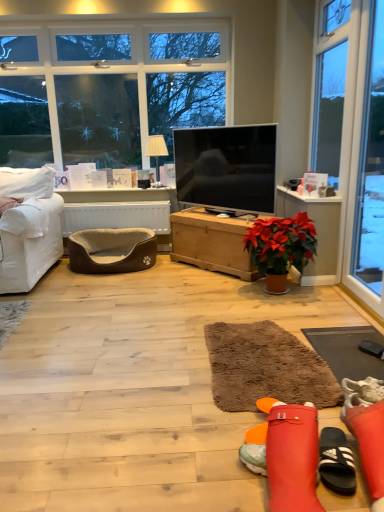
At what (x,y) coordinates should I click in order to perform the action: click on blank space situated above brown fabric pet bed at left, which is the 2th table from right to left (from a real-world perspective). Please return your answer as a coordinate pair (x, y). The height and width of the screenshot is (512, 384). Looking at the image, I should click on (96, 202).